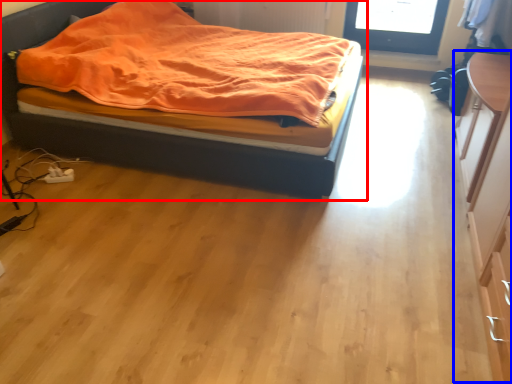
Question: Which object appears closest to the camera in this image, bed (highlighted by a red box) or dresser (highlighted by a blue box)?

Choices:
 (A) bed
 (B) dresser

Answer: (B)